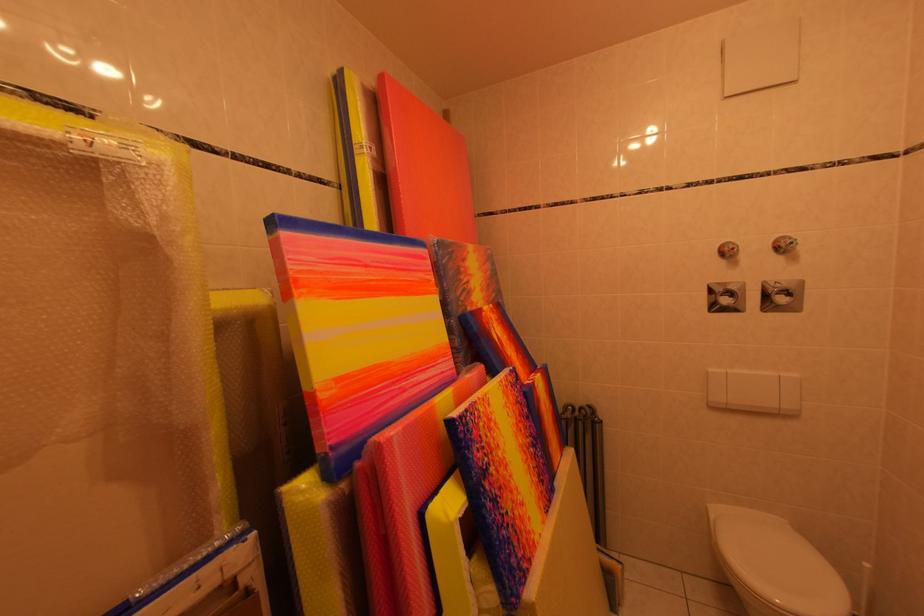
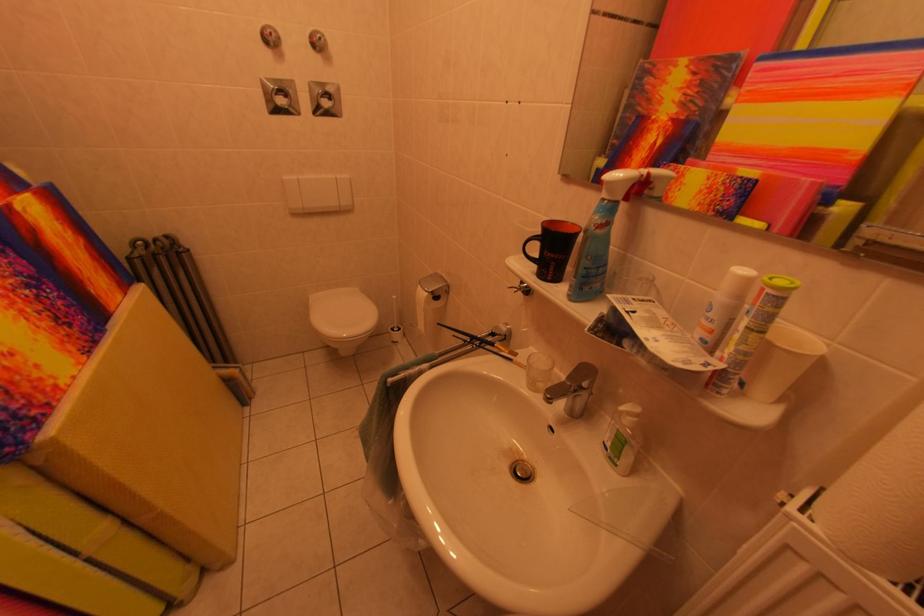
In the second image, find the point that corresponds to the point at 725,515 in the first image.

(322, 301)